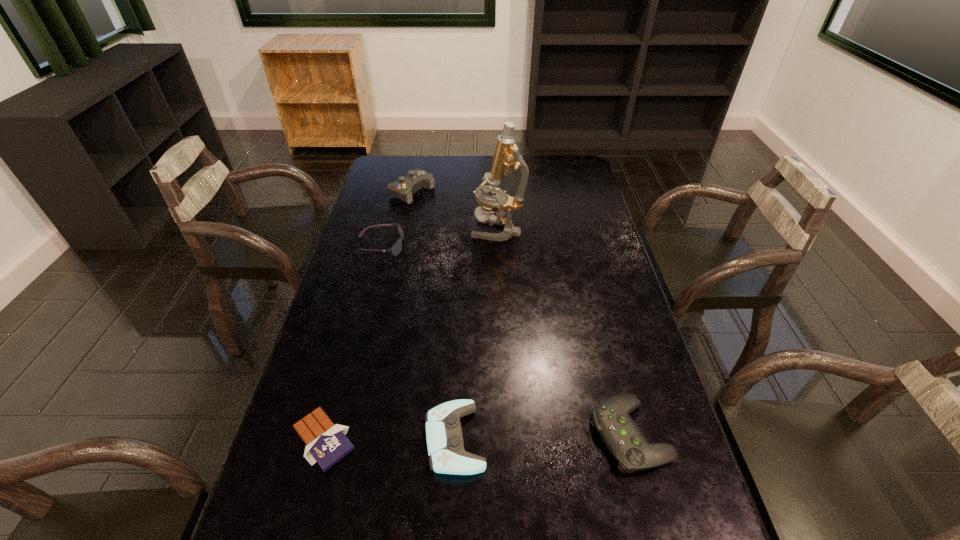
Image resolution: width=960 pixels, height=540 pixels. I want to click on vacant area at the left edge, so click(x=363, y=211).

The image size is (960, 540). I want to click on vacant point at the right edge, so click(610, 309).

Identify the location of unoccupied position between the second control from left to right and the tallest object. The width and height of the screenshot is (960, 540). (476, 334).

At what (x,y) coordinates should I click in order to perform the action: click on free space between the tallest control and the rightmost control. Please return your answer as a coordinate pair (x, y). Image resolution: width=960 pixels, height=540 pixels. Looking at the image, I should click on (521, 313).

Find the location of a particular element. empty space between the rightmost object and the chocolate bar is located at coordinates (477, 437).

Image resolution: width=960 pixels, height=540 pixels. What are the coordinates of `free spot between the tallest control and the microscope` in the screenshot? It's located at pyautogui.click(x=454, y=211).

Locate an element on the screen. free space between the leftmost control and the sunglasses is located at coordinates (396, 219).

Identify the location of free space between the rightmost control and the sunglasses. (505, 340).

The width and height of the screenshot is (960, 540). Identify the location of blank region between the second control from right to left and the rightmost control. (542, 437).

Image resolution: width=960 pixels, height=540 pixels. Identify the location of vacant space that is in between the sunglasses and the second tallest object. (396, 219).